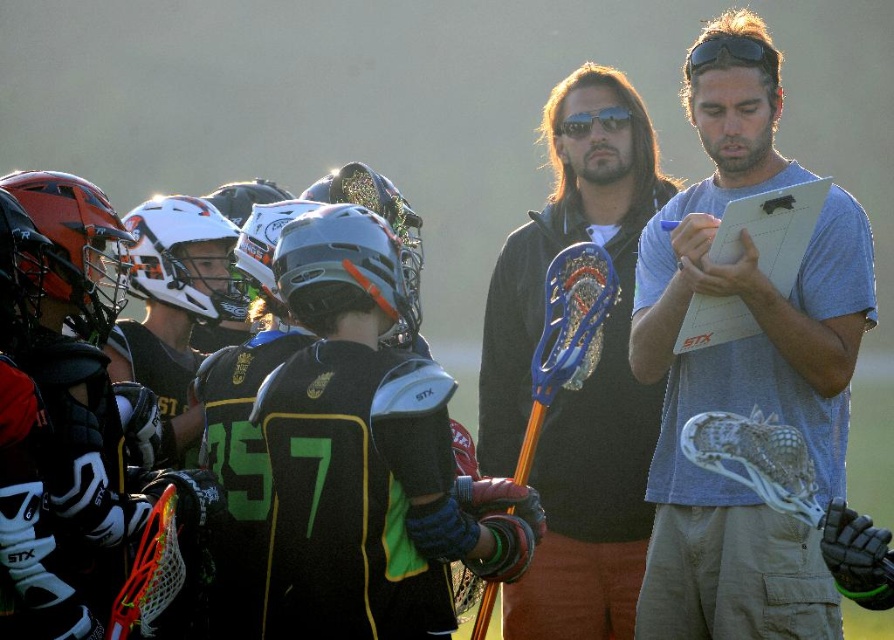
Is gray cotton shirt at center further to camera compared to black matte jacket at center?

No.

Is gray cotton shirt at center bigger than black matte jacket at center?

Yes, gray cotton shirt at center is bigger than black matte jacket at center.

Find the location of a particular element. gray cotton shirt at center is located at coordinates (744, 364).